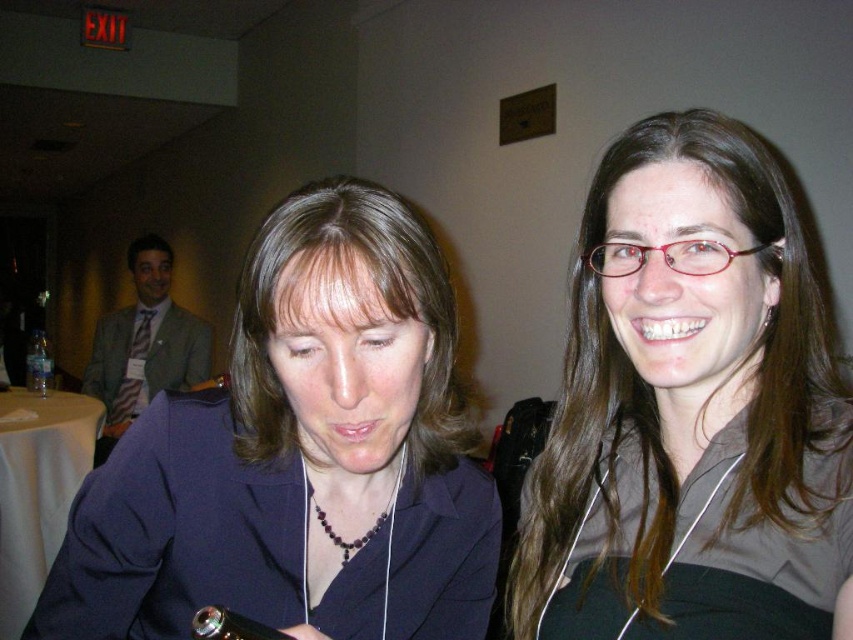
You are standing in the room and want to locate the matte gray shirt at upper right. What are the coordinates of its position?

The coordinates of the matte gray shirt at upper right are at point (691, 410).

You are trying to locate the matte gray shirt at upper right in the image. What are the coordinates where it can be found?

The matte gray shirt at upper right can be found at coordinates point [691,410].